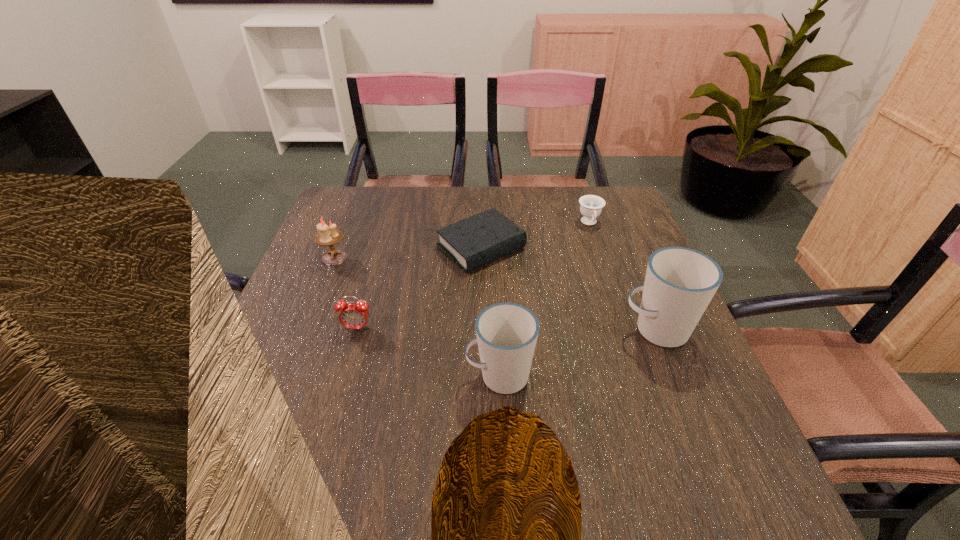
In order to click on free point at the far right corner in this screenshot , I will do `click(593, 188)`.

This screenshot has height=540, width=960. I want to click on vacant space that's between the shorter cup and the teacup, so click(544, 300).

Locate an element on the screen. vacant area that lies between the second object from left to right and the teacup is located at coordinates (473, 276).

The height and width of the screenshot is (540, 960). What are the coordinates of `vacant region between the Bible and the leftmost object` in the screenshot? It's located at (408, 253).

Identify the location of free space between the shorter cup and the taller cup. (578, 353).

What are the coordinates of `free spot between the fifth tallest object and the Bible` in the screenshot? It's located at (535, 235).

At what (x,y) coordinates should I click in order to perform the action: click on vacant area between the Bible and the teacup. Please return your answer as a coordinate pair (x, y). This screenshot has width=960, height=540. Looking at the image, I should click on (535, 235).

Where is `vacant point located between the tallest object and the shorter cup`? The width and height of the screenshot is (960, 540). vacant point located between the tallest object and the shorter cup is located at coordinates (578, 353).

The width and height of the screenshot is (960, 540). Find the location of `empty space that is in between the candle holder and the Bible`. empty space that is in between the candle holder and the Bible is located at coordinates (408, 253).

Where is `object that stands as the third closest to the shortest object`? The image size is (960, 540). object that stands as the third closest to the shortest object is located at coordinates coord(680,282).